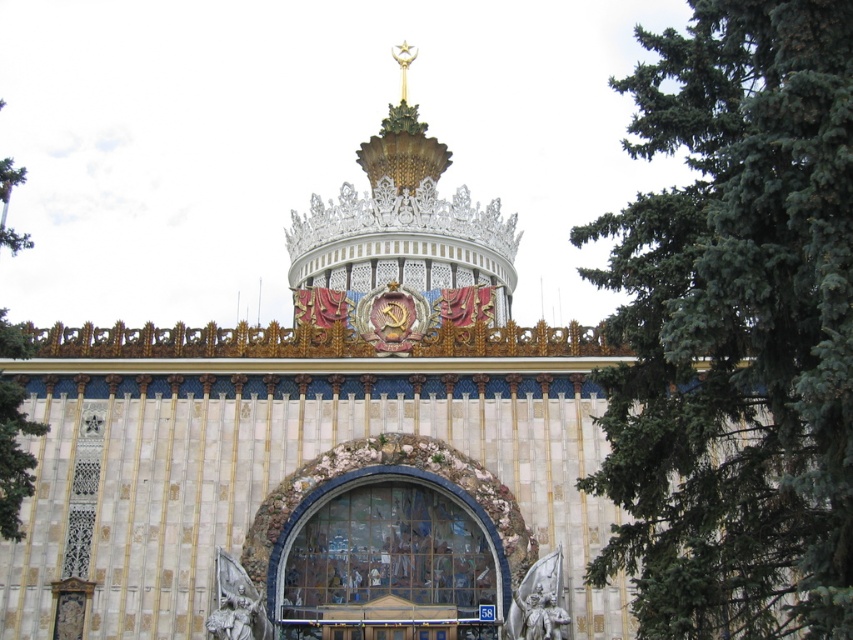
Can you confirm if green needle-like leaves at upper right is positioned below green leafy tree at left?

Correct, green needle-like leaves at upper right is located below green leafy tree at left.

Where is `green needle-like leaves at upper right`? green needle-like leaves at upper right is located at coordinates (735, 330).

Locate an element on the screen. green needle-like leaves at upper right is located at coordinates (735, 330).

Who is taller, translucent glass mosaic at center or green leafy tree at left?

green leafy tree at left is taller.

At what (x,y) coordinates should I click in order to perform the action: click on translucent glass mosaic at center. Please return your answer as a coordinate pair (x, y). Looking at the image, I should click on (392, 561).

Is green needle-like leaves at upper right positioned behind translucent glass mosaic at center?

No, it is not.

I want to click on green needle-like leaves at upper right, so click(735, 330).